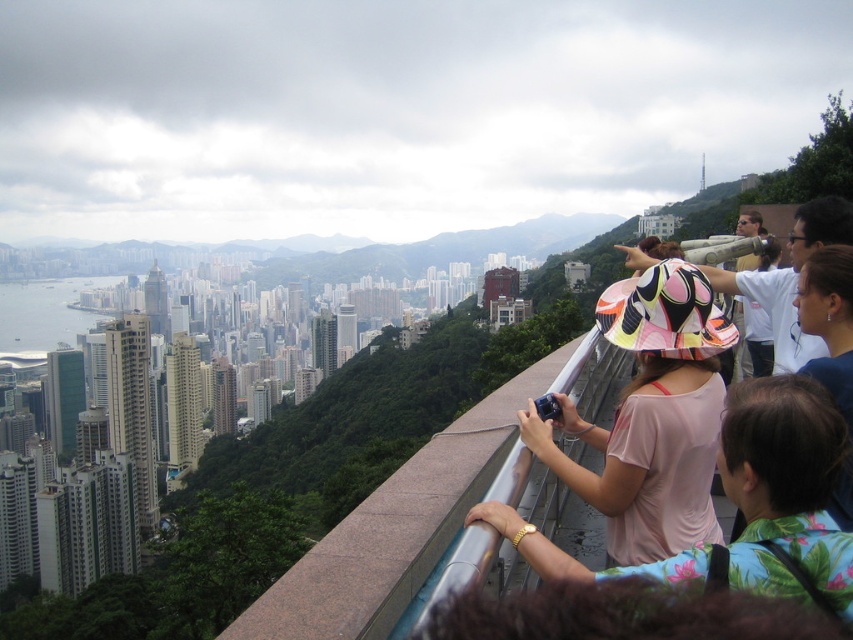
You are a photographer aiming to capture the pink fabric dress at center and the blue fabric at upper right in a single frame. Based on their positions, which object would appear closer to the bottom of the photo?

The pink fabric dress at center appears closer to the bottom of the photo because it is positioned below the blue fabric at upper right.

You are a photographer standing at the overlook and want to capture both the pink fabric dress at center and the blue fabric at upper right in your shot. Which of the two items should you focus on first to ensure they are both in frame?

The pink fabric dress at center is not as tall as the blue fabric at upper right, so you should focus on the blue fabric at upper right first to ensure both are in frame.